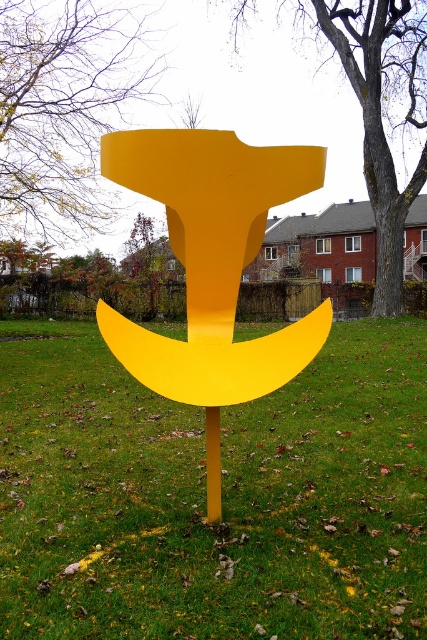
Describe the element at coordinates (204, 497) in the screenshot. I see `green grass at center` at that location.

Who is lower down, green grass at center or smooth bark tree at upper left?

Positioned lower is green grass at center.

Locate an element on the screen. green grass at center is located at coordinates (204, 497).

The height and width of the screenshot is (640, 427). I want to click on green grass at center, so click(x=204, y=497).

Does matte yellow anchor at center have a lesser width compared to smooth bark tree at upper left?

Incorrect, matte yellow anchor at center's width is not less than smooth bark tree at upper left's.

Consider the image. Does matte yellow anchor at center have a greater height compared to smooth bark tree at upper left?

Indeed, matte yellow anchor at center has a greater height compared to smooth bark tree at upper left.

Is point (215, 364) positioned in front of point (46, 188)?

Yes.

Find the location of a particular element. The height and width of the screenshot is (640, 427). matte yellow anchor at center is located at coordinates click(211, 259).

Who is higher up, matte yellow anchor at center or yellow matte pole at center?

matte yellow anchor at center is higher up.

Who is more distant from viewer, (213, 321) or (215, 497)?

The point (213, 321) is behind.

What do you see at coordinates (211, 259) in the screenshot? Image resolution: width=427 pixels, height=640 pixels. I see `matte yellow anchor at center` at bounding box center [211, 259].

This screenshot has width=427, height=640. I want to click on matte yellow anchor at center, so click(211, 259).